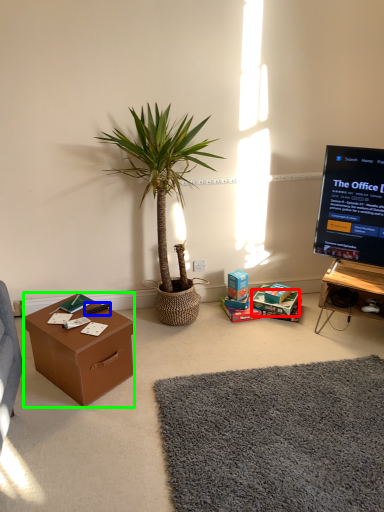
Question: Estimate the real-world distances between objects in this image. Which object is farther from storage box (highlighted by a red box), remote control (highlighted by a blue box) or desk (highlighted by a green box)?

Choices:
 (A) remote control
 (B) desk

Answer: (B)